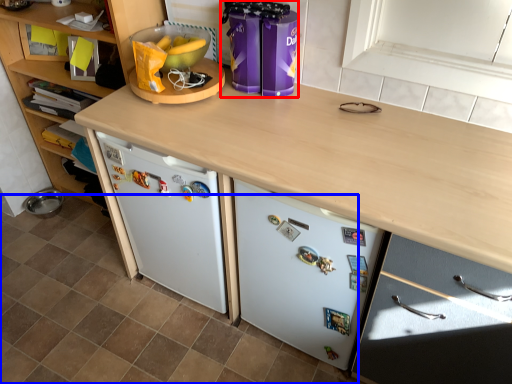
Question: Which of the following is the farthest to the observer, appliance (highlighted by a red box) or tile (highlighted by a blue box)?

Choices:
 (A) appliance
 (B) tile

Answer: (A)